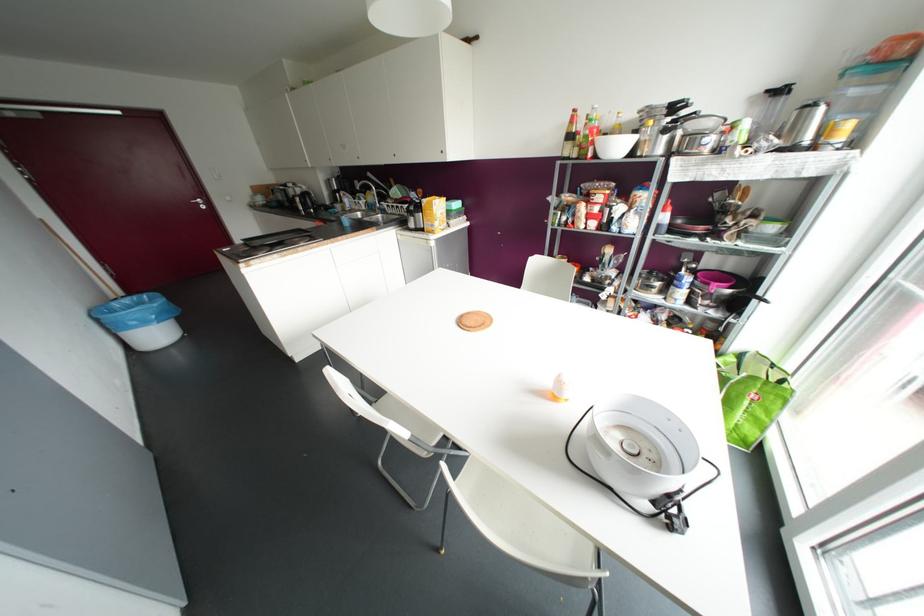
This screenshot has width=924, height=616. What do you see at coordinates (713, 278) in the screenshot?
I see `a pink lid handle` at bounding box center [713, 278].